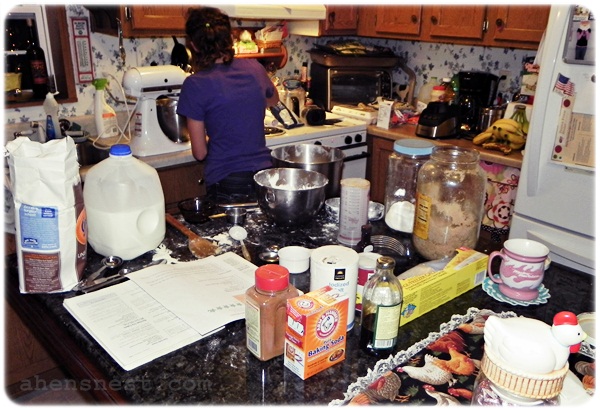
You are a GUI agent. You are given a task and a screenshot of the screen. Output one action in this format:
    pyautogui.click(x=<x>, y=<y>)
    Task: Click on the coffee cup
    The width and height of the screenshot is (600, 410).
    Given the screenshot: What is the action you would take?
    pyautogui.click(x=520, y=267)